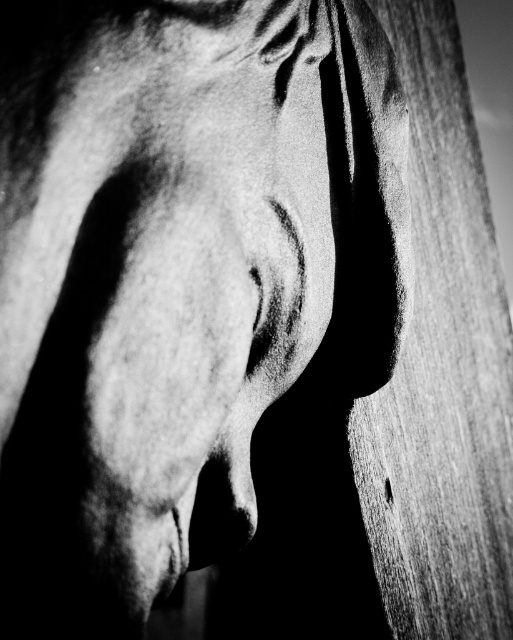
What do you see at coordinates (442, 371) in the screenshot? I see `wooden plank at right` at bounding box center [442, 371].

Between wooden plank at right and smooth gray nose at center, which one appears on the right side from the viewer's perspective?

Positioned to the right is wooden plank at right.

Which is behind, point (486, 605) or point (219, 467)?

The point (486, 605) is behind.

What are the coordinates of `wooden plank at right` in the screenshot? It's located at (442, 371).